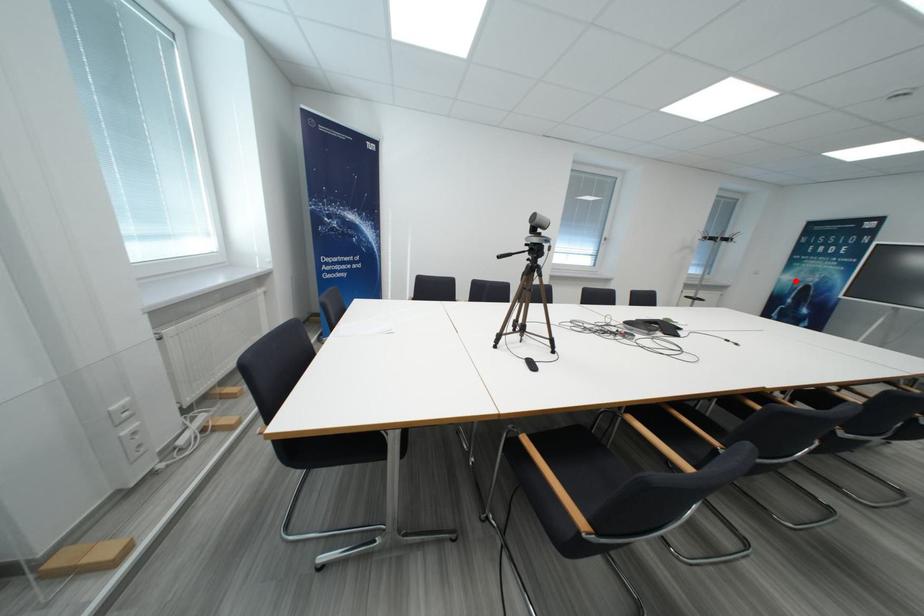
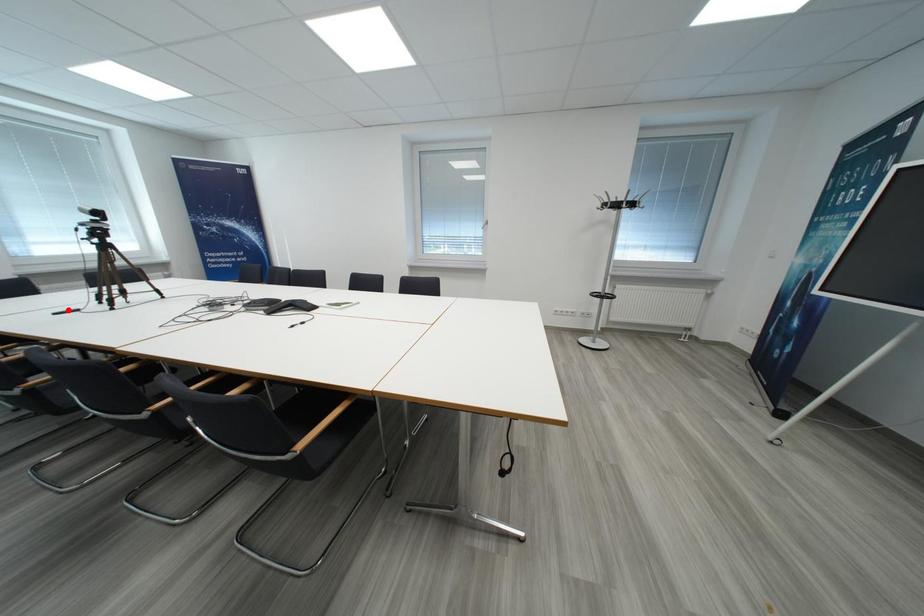
I am providing you with two images of the same scene from different viewpoints. A red point is marked on the first image and another point is marked on the second image. Does the point marked in image1 correspond to the same location as the one in image2?

No